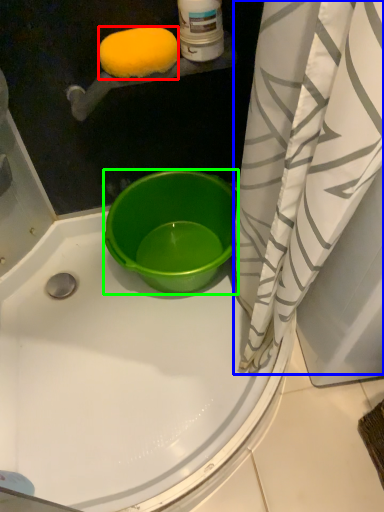
Question: Based on their relative distances, which object is farther from lemon (highlighted by a red box)? Choose from curtain (highlighted by a blue box) and bucket (highlighted by a green box).

Choices:
 (A) curtain
 (B) bucket

Answer: (B)